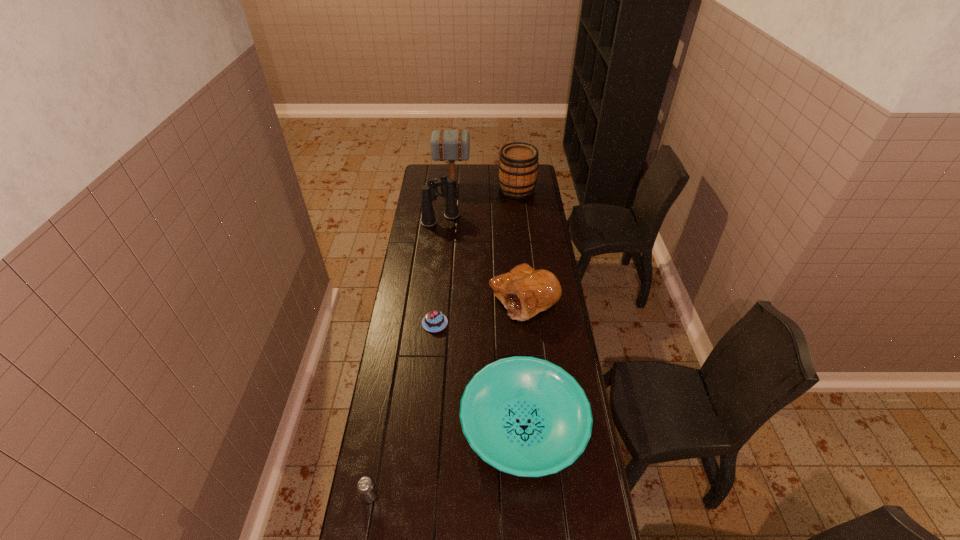
This screenshot has width=960, height=540. Find the location of `the tallest object`. the tallest object is located at coordinates (446, 145).

Where is `the fifth nearest object`? the fifth nearest object is located at coordinates (447, 187).

Locate an element on the screen. The height and width of the screenshot is (540, 960). cider is located at coordinates (518, 165).

Identify the location of bread. (524, 292).

Identify the location of dish. (525, 416).

In order to click on the leftmost object in this screenshot , I will do `click(365, 486)`.

Find the location of a particular element. The width and height of the screenshot is (960, 540). chocolate cake is located at coordinates (434, 321).

At what (x,y) coordinates should I click in order to perform the action: click on vacant region located 0.330m on the striking surface of the tallest object. Please return your answer as a coordinate pair (x, y). This screenshot has height=540, width=960. Looking at the image, I should click on (525, 184).

Find the location of `vacant space located 0.140m on the right of the binoculars`. vacant space located 0.140m on the right of the binoculars is located at coordinates (485, 220).

Locate an element on the screen. The image size is (960, 540). vacant region located 0.260m on the front of the cider is located at coordinates (521, 228).